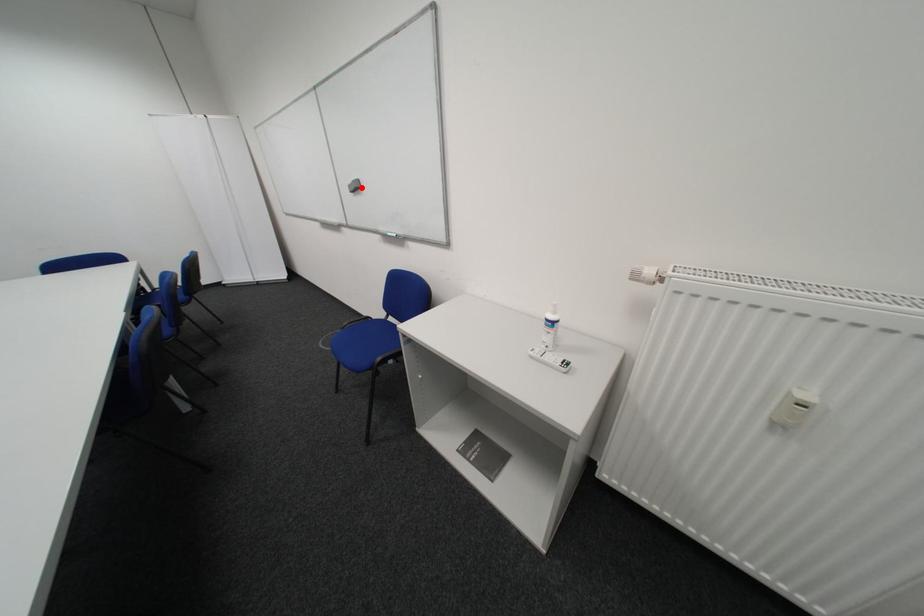
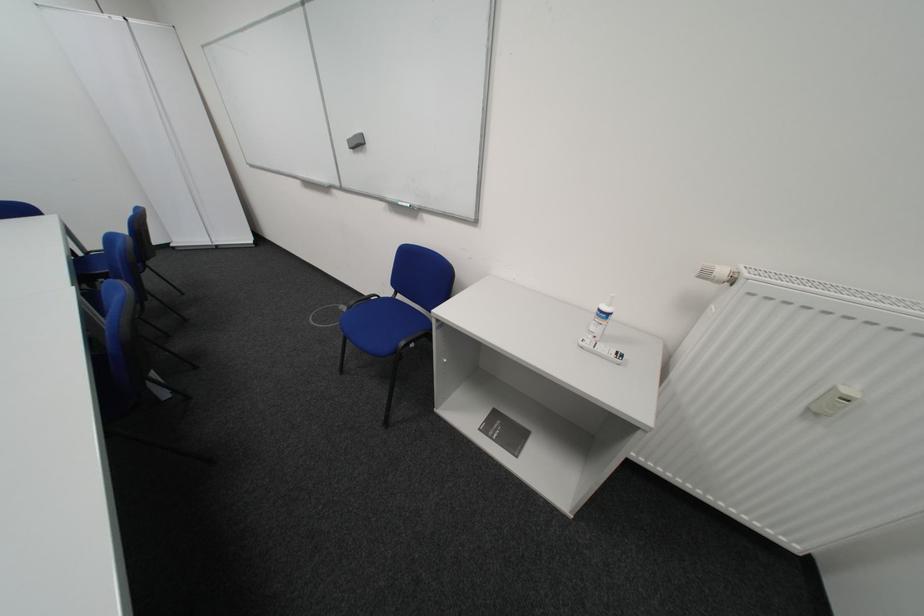
Question: A red point is marked in image1. In image2, is the corresponding 3D point closer to the camera or farther? Reply with the corresponding letter.

Choices:
 (A) The corresponding 3D point is closer.
 (B) The corresponding 3D point is farther.

Answer: (B)